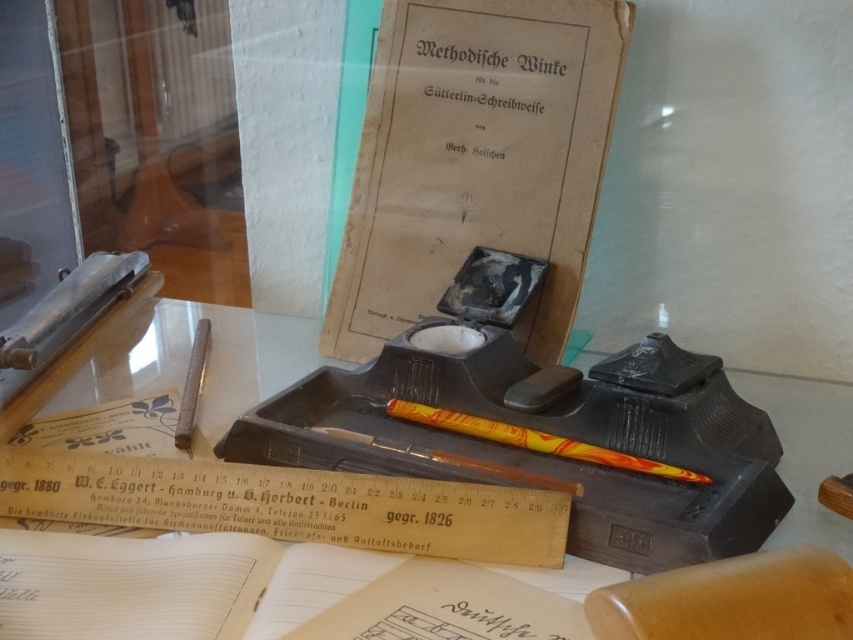
Between point (68, 515) and point (802, 524), which one is positioned in front?

Point (802, 524) is in front.

Does wooden ruler at lower center have a lesser height compared to matte black inkwell at center?

Yes, wooden ruler at lower center is shorter than matte black inkwell at center.

This screenshot has width=853, height=640. What do you see at coordinates (288, 504) in the screenshot?
I see `wooden ruler at lower center` at bounding box center [288, 504].

Find the location of a particular element. Image resolution: width=853 pixels, height=640 pixels. wooden ruler at lower center is located at coordinates (288, 504).

Is wooden ruler at lower center wider than marbled yellow-orange pencil at center?

Yes.

Does wooden ruler at lower center have a smaller size compared to marbled yellow-orange pencil at center?

No, wooden ruler at lower center is not smaller than marbled yellow-orange pencil at center.

Between point (154, 492) and point (416, 410), which one is positioned behind?

The point (416, 410) is behind.

What are the coordinates of `wooden ruler at lower center` in the screenshot? It's located at (288, 504).

From the picture: Can you confirm if matte black inkwell at center is wider than marbled yellow-orange pencil at center?

In fact, matte black inkwell at center might be narrower than marbled yellow-orange pencil at center.

You are a GUI agent. You are given a task and a screenshot of the screen. Output one action in this format:
    pyautogui.click(x=<x>, y=<y>)
    Task: Click on the matte black inkwell at center
    The height and width of the screenshot is (640, 853).
    Given the screenshot: What is the action you would take?
    pyautogui.click(x=187, y=358)